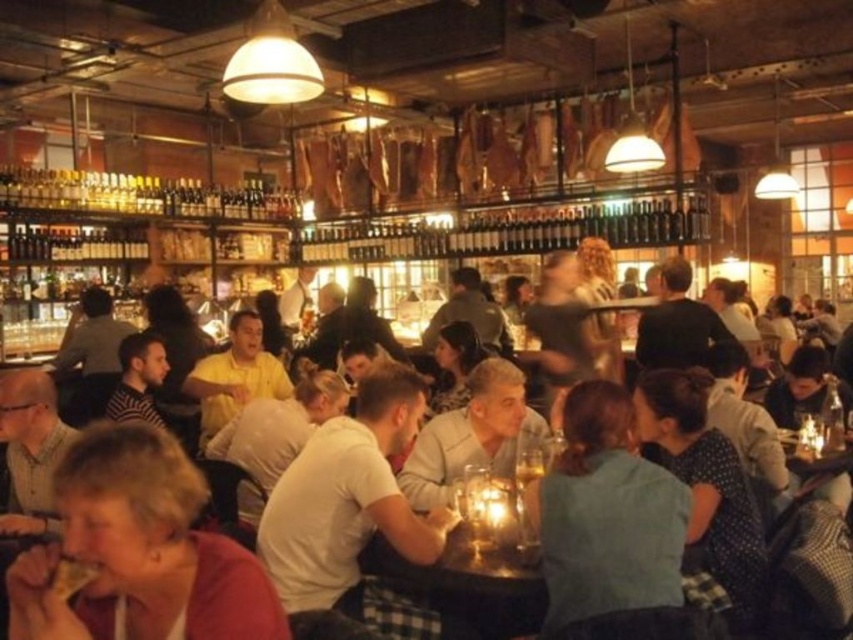
Question: Does white cotton shirt at center have a greater width compared to wooden table at center?

Choices:
 (A) no
 (B) yes

Answer: (B)

Question: Among these objects, which one is nearest to the camera?

Choices:
 (A) green fabric shirt at center
 (B) white cotton shirt at center

Answer: (A)

Question: Considering the relative positions of matte red shirt at lower left and wooden table at center in the image provided, where is matte red shirt at lower left located with respect to wooden table at center?

Choices:
 (A) right
 (B) left

Answer: (B)

Question: Which point is farther to the camera?

Choices:
 (A) (619, 552)
 (B) (466, 532)
 (C) (335, 570)
 (D) (126, 584)

Answer: (B)

Question: Which of the following is the farthest from the observer?

Choices:
 (A) (573, 426)
 (B) (492, 604)
 (C) (78, 605)

Answer: (B)

Question: Is matte red shirt at lower left smaller than wooden table at center?

Choices:
 (A) no
 (B) yes

Answer: (A)